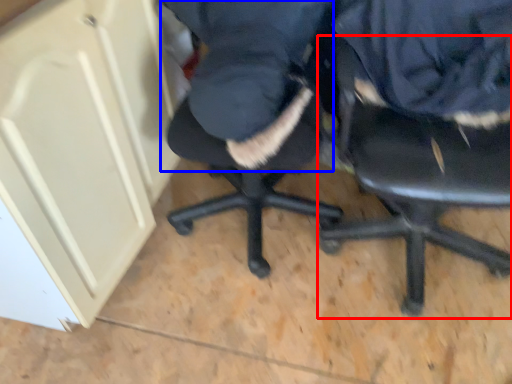
Question: Among these objects, which one is nearest to the camera, chair (highlighted by a red box) or clothing (highlighted by a blue box)?

Choices:
 (A) chair
 (B) clothing

Answer: (A)